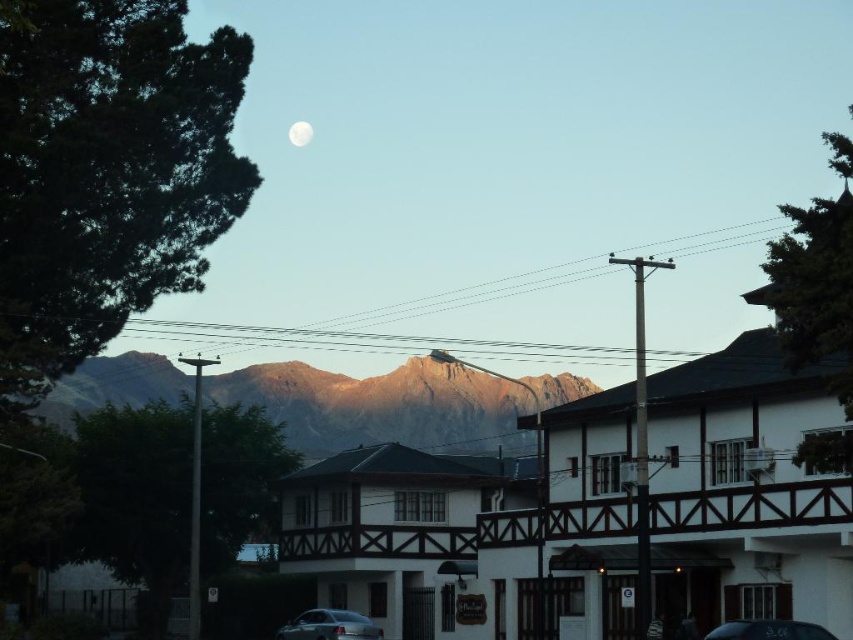
You are standing at the entrance of the house and want to move to the car. According to the image, where is the satin silver sedan at lower center located relative to your current position?

The satin silver sedan at lower center is located at point 0.978 on the x axis and 0.387 on the y axis relative to your current position.

You are an astronaut who has just landed on the moon and you see the white wooden hotel at center and the white matte moon at upper center in the sky. Which object is closer to you?

The white wooden hotel at center is closer to the viewer than the white matte moon at upper center.

You are an architect designing a new suburban neighborhood. You want to ensure that the new houses will not block the view of the moon from the central hotel. Based on the scene, can you confirm if the white wooden hotel at center is wider than the white matte moon at upper center?

The white wooden hotel at center is wider than the white matte moon at upper center, so yes, the hotel is wider than the moon. This means that if the new houses are placed in a way that aligns with the existing arrangement, they might not obstruct the moon view as long as their placement doesn not interfere with the existing spatial relationship between the hotel and the moon.